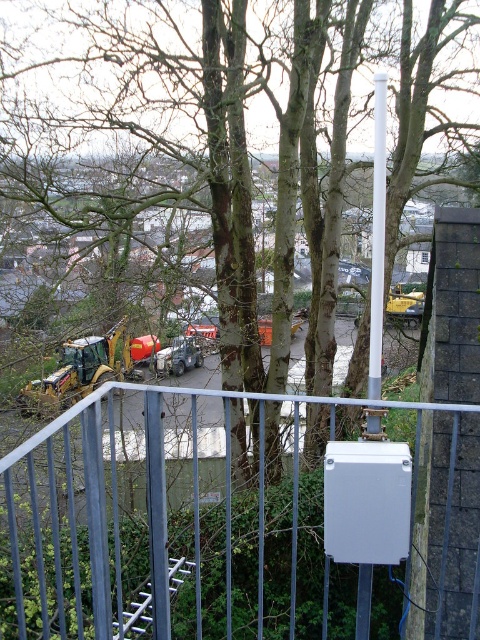
From the picture: Who is lower down, metallic gray fence at center or yellow metallic excavator at lower left?

metallic gray fence at center is lower down.

Is point (417, 486) less distant than point (47, 413)?

Yes.

Locate an element on the screen. This screenshot has width=480, height=640. metallic gray fence at center is located at coordinates (228, 525).